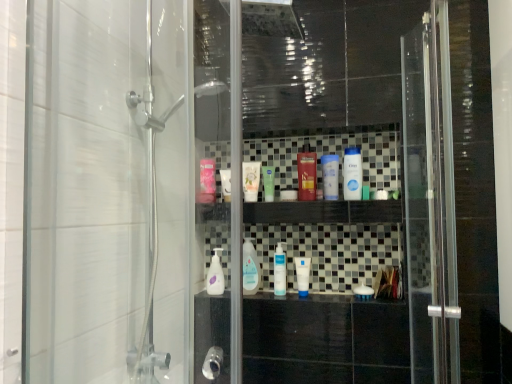
Measure the distance between point (256, 268) and camera.

Point (256, 268) is 5.53 feet from camera.

Where is `white glossy mouthwash at center, which appears as the fourth mouthwash when viewed from the right`? This screenshot has width=512, height=384. white glossy mouthwash at center, which appears as the fourth mouthwash when viewed from the right is located at coordinates (279, 271).

What do you see at coordinates (303, 275) in the screenshot? This screenshot has height=384, width=512. I see `white matte tube at center, the second toiletry positioned from the left` at bounding box center [303, 275].

Locate an element on the screen. Image resolution: width=512 pixels, height=384 pixels. transparent glass screen door at center is located at coordinates (324, 219).

Describe the element at coordinates (306, 176) in the screenshot. The width and height of the screenshot is (512, 384). I see `shiny red plastic bottle at center, arranged as the fifth mouthwash when viewed from the left` at that location.

This screenshot has width=512, height=384. Find the location of `white glossy mouthwash at upper center, the 1th mouthwash viewed from the right`. white glossy mouthwash at upper center, the 1th mouthwash viewed from the right is located at coordinates (352, 174).

Describe the element at coordinates (251, 180) in the screenshot. I see `white matte tube at center, which appears as the 1th toiletry when viewed from the left` at that location.

You are a GUI agent. You are given a task and a screenshot of the screen. Output one action in this format:
    pyautogui.click(x=<x>, y=<y>)
    Task: Click on the green matte tube at center, the fifth mouthwash when ordered from right to left
    The width and height of the screenshot is (512, 384).
    Given the screenshot: What is the action you would take?
    pyautogui.click(x=268, y=182)

Find the location of `clear plastic mouthwash at center, the 2th mouthwash from the left`. clear plastic mouthwash at center, the 2th mouthwash from the left is located at coordinates (250, 268).

Does white matte tube at center, the second toiletry from the top, contain clear plastic mouthwash at center, acting as the 6th mouthwash starting from the right?

No, clear plastic mouthwash at center, acting as the 6th mouthwash starting from the right, is not inside white matte tube at center, the second toiletry from the top.

Is clear plastic mouthwash at center, acting as the 6th mouthwash starting from the right, at the back of white matte tube at center, the second toiletry from the top?

No.

Is white matte tube at center, the second toiletry positioned from the left, bigger than clear plastic mouthwash at center, the 2th mouthwash from the left?

Actually, white matte tube at center, the second toiletry positioned from the left, might be smaller than clear plastic mouthwash at center, the 2th mouthwash from the left.

Considering the relative sizes of white matte tube at center, the second toiletry from the top, and white glossy mouthwash at upper center, acting as the seventh mouthwash starting from the left, in the image provided, is white matte tube at center, the second toiletry from the top, smaller than white glossy mouthwash at upper center, acting as the seventh mouthwash starting from the left,?

Yes, white matte tube at center, the second toiletry from the top, is smaller than white glossy mouthwash at upper center, acting as the seventh mouthwash starting from the left.

Is white matte tube at center, acting as the first toiletry starting from the right, completely or partially outside of white glossy mouthwash at upper center, the 1th mouthwash viewed from the right?

white matte tube at center, acting as the first toiletry starting from the right, lies outside white glossy mouthwash at upper center, the 1th mouthwash viewed from the right,'s area.

Which of these two, white matte tube at center, the second toiletry positioned from the left, or white glossy mouthwash at upper center, the 1th mouthwash viewed from the right, is wider?

white glossy mouthwash at upper center, the 1th mouthwash viewed from the right.

Is clear plastic mouthwash at center, acting as the 6th mouthwash starting from the right, aimed at white glossy mouthwash at center, marked as the 4th mouthwash in a left-to-right arrangement?

No, clear plastic mouthwash at center, acting as the 6th mouthwash starting from the right, is not turned towards white glossy mouthwash at center, marked as the 4th mouthwash in a left-to-right arrangement.

From the image's perspective, does clear plastic mouthwash at center, acting as the 6th mouthwash starting from the right, appear lower than white glossy mouthwash at center, which appears as the fourth mouthwash when viewed from the right?

No, from the image's perspective, clear plastic mouthwash at center, acting as the 6th mouthwash starting from the right, is not beneath white glossy mouthwash at center, which appears as the fourth mouthwash when viewed from the right.

You are a GUI agent. You are given a task and a screenshot of the screen. Output one action in this format:
    pyautogui.click(x=<x>, y=<y>)
    Task: Click on the 1st mouthwash above when counting from the white glossy mouthwash at center, marked as the 4th mouthwash in a left-to-right arrangement (from the image's perspective)
    This screenshot has width=512, height=384.
    Given the screenshot: What is the action you would take?
    pyautogui.click(x=250, y=268)

From a real-world perspective, is clear plastic mouthwash at center, acting as the 6th mouthwash starting from the right, on white glossy mouthwash at center, marked as the 4th mouthwash in a left-to-right arrangement?

Indeed, from a real-world perspective, clear plastic mouthwash at center, acting as the 6th mouthwash starting from the right, stands above white glossy mouthwash at center, marked as the 4th mouthwash in a left-to-right arrangement.

Is white matte tube at center, the second toiletry from the top, not near green matte tube at center, placed as the third mouthwash when sorted from left to right?

No, white matte tube at center, the second toiletry from the top, is not far from green matte tube at center, placed as the third mouthwash when sorted from left to right.

Considering the sizes of white matte tube at center, the 1th toiletry ordered from the bottom, and green matte tube at center, the fifth mouthwash when ordered from right to left, in the image, is white matte tube at center, the 1th toiletry ordered from the bottom, wider or thinner than green matte tube at center, the fifth mouthwash when ordered from right to left,?

Clearly, white matte tube at center, the 1th toiletry ordered from the bottom, has less width compared to green matte tube at center, the fifth mouthwash when ordered from right to left.

Where is `the 3rd mouthwash above the white matte tube at center, the second toiletry from the top (from a real-world perspective)`? the 3rd mouthwash above the white matte tube at center, the second toiletry from the top (from a real-world perspective) is located at coordinates (268, 182).

Is white matte tube at center, the second toiletry positioned from the left, positioned beyond the bounds of green matte tube at center, the fifth mouthwash when ordered from right to left?

Absolutely, white matte tube at center, the second toiletry positioned from the left, is external to green matte tube at center, the fifth mouthwash when ordered from right to left.

In the image, is shiny red plastic bottle at center, the third mouthwash viewed from the right, positioned in front of or behind clear plastic mouthwash at center, the 2th mouthwash from the left?

Visually, shiny red plastic bottle at center, the third mouthwash viewed from the right, is located in front of clear plastic mouthwash at center, the 2th mouthwash from the left.

Could clear plastic mouthwash at center, the 2th mouthwash from the left, be considered to be inside shiny red plastic bottle at center, arranged as the fifth mouthwash when viewed from the left?

No, shiny red plastic bottle at center, arranged as the fifth mouthwash when viewed from the left, does not contain clear plastic mouthwash at center, the 2th mouthwash from the left.

Is clear plastic mouthwash at center, acting as the 6th mouthwash starting from the right, at the back of shiny red plastic bottle at center, the third mouthwash viewed from the right?

No.

From a real-world perspective, does shiny red plastic bottle at center, arranged as the fifth mouthwash when viewed from the left, sit lower than clear plastic mouthwash at center, acting as the 6th mouthwash starting from the right?

No.

Starting from the white glossy mouthwash at upper center, acting as the seventh mouthwash starting from the left, which mouthwash is the 5th one to the left? Please provide its 2D coordinates.

[(250, 268)]

Looking at the image, does clear plastic mouthwash at center, the 2th mouthwash from the left, seem bigger or smaller compared to white glossy mouthwash at upper center, the 1th mouthwash viewed from the right?

Clearly, clear plastic mouthwash at center, the 2th mouthwash from the left, is larger in size than white glossy mouthwash at upper center, the 1th mouthwash viewed from the right.

Is clear plastic mouthwash at center, the 2th mouthwash from the left, facing away from white glossy mouthwash at upper center, acting as the seventh mouthwash starting from the left?

clear plastic mouthwash at center, the 2th mouthwash from the left, is not turned away from white glossy mouthwash at upper center, acting as the seventh mouthwash starting from the left.

Considering the positions of objects clear plastic mouthwash at center, the 2th mouthwash from the left, and white glossy mouthwash at upper center, the 1th mouthwash viewed from the right, in the image provided, who is more to the left, clear plastic mouthwash at center, the 2th mouthwash from the left, or white glossy mouthwash at upper center, the 1th mouthwash viewed from the right,?

clear plastic mouthwash at center, the 2th mouthwash from the left, is more to the left.

Which object is closer to the camera taking this photo, white glossy mouthwash at upper center, the 1th mouthwash viewed from the right, or clear plastic mouthwash at center, acting as the 6th mouthwash starting from the right?

Positioned in front is white glossy mouthwash at upper center, the 1th mouthwash viewed from the right.

Is white glossy mouthwash at upper center, the 1th mouthwash viewed from the right, looking in the opposite direction of clear plastic mouthwash at center, the 2th mouthwash from the left?

No, white glossy mouthwash at upper center, the 1th mouthwash viewed from the right, is not facing the opposite direction of clear plastic mouthwash at center, the 2th mouthwash from the left.

How many degrees apart are the facing directions of white glossy mouthwash at upper center, the 1th mouthwash viewed from the right, and clear plastic mouthwash at center, the 2th mouthwash from the left?

The angular difference between white glossy mouthwash at upper center, the 1th mouthwash viewed from the right, and clear plastic mouthwash at center, the 2th mouthwash from the left, is 0.00187 degrees.

Between white glossy mouthwash at upper center, the 1th mouthwash viewed from the right, and clear plastic mouthwash at center, the 2th mouthwash from the left, which one has larger size?

clear plastic mouthwash at center, the 2th mouthwash from the left, is bigger.

Which toiletry is the 2nd one when counting from the right side of the clear plastic mouthwash at center, the 2th mouthwash from the left? Please provide its 2D coordinates.

[(303, 275)]

This screenshot has height=384, width=512. There is a white matte tube at center, the second toiletry from the top. What are the coordinates of `the 6th mouthwash above it (from the image's perspective)` in the screenshot? It's located at (352, 174).

Estimate the real-world distances between objects in this image. Which object is further from green matte tube at center, placed as the third mouthwash when sorted from left to right, white matte tube at center, which appears as the 1th toiletry when viewed from the left, or blue plastic mouthwash at center, the 2th mouthwash when ordered from right to left?

Answer: blue plastic mouthwash at center, the 2th mouthwash when ordered from right to left.

Considering their positions, is transparent glass screen door at center positioned closer to shiny red plastic bottle at center, arranged as the fifth mouthwash when viewed from the left, than white glossy mouthwash at upper center, acting as the seventh mouthwash starting from the left?

Among the two, white glossy mouthwash at upper center, acting as the seventh mouthwash starting from the left, is located nearer to shiny red plastic bottle at center, arranged as the fifth mouthwash when viewed from the left.

Which object lies further to the anchor point shiny red plastic bottle at center, arranged as the fifth mouthwash when viewed from the left, clear plastic mouthwash at center, acting as the 6th mouthwash starting from the right, or blue plastic mouthwash at center, the sixth mouthwash viewed from the left?

Based on the image, clear plastic mouthwash at center, acting as the 6th mouthwash starting from the right, appears to be further to shiny red plastic bottle at center, arranged as the fifth mouthwash when viewed from the left.

When comparing their distances from blue plastic mouthwash at center, the 2th mouthwash when ordered from right to left, does clear plastic mouthwash at center, the 2th mouthwash from the left, or green matte tube at center, the fifth mouthwash when ordered from right to left, seem further?

clear plastic mouthwash at center, the 2th mouthwash from the left, is further to blue plastic mouthwash at center, the 2th mouthwash when ordered from right to left.

Looking at the image, which one is located closer to shiny red plastic bottle at center, arranged as the fifth mouthwash when viewed from the left, white matte tube at center, acting as the second toiletry starting from the right, or blue plastic mouthwash at center, the sixth mouthwash viewed from the left?

blue plastic mouthwash at center, the sixth mouthwash viewed from the left, lies closer to shiny red plastic bottle at center, arranged as the fifth mouthwash when viewed from the left, than the other object.

When comparing their distances from shiny red plastic bottle at center, the third mouthwash viewed from the right, does white matte tube at center, which appears as the 1th toiletry when viewed from the left, or pink glossy mouthwash at center, marked as the first mouthwash in a left-to-right arrangement, seem further?

Based on the image, pink glossy mouthwash at center, marked as the first mouthwash in a left-to-right arrangement, appears to be further to shiny red plastic bottle at center, the third mouthwash viewed from the right.

From the image, which object appears to be farther from pink glossy mouthwash at center, marked as the first mouthwash in a left-to-right arrangement, shiny red plastic bottle at center, the third mouthwash viewed from the right, or transparent glass screen door at center?

transparent glass screen door at center lies further to pink glossy mouthwash at center, marked as the first mouthwash in a left-to-right arrangement, than the other object.

Estimate the real-world distances between objects in this image. Which object is further from white matte tube at center, the second toiletry from the top, shiny red plastic bottle at center, the third mouthwash viewed from the right, or clear plastic mouthwash at center, acting as the 6th mouthwash starting from the right?

shiny red plastic bottle at center, the third mouthwash viewed from the right, is positioned further to the anchor white matte tube at center, the second toiletry from the top.

Image resolution: width=512 pixels, height=384 pixels. I want to click on toiletry between transparent glass screen door at center and clear plastic mouthwash at center, the 2th mouthwash from the left, from front to back, so click(x=303, y=275).

Where is `toiletry between pink glossy mouthwash at center, acting as the seventh mouthwash starting from the right, and white matte tube at center, the second toiletry positioned from the left, vertically`? toiletry between pink glossy mouthwash at center, acting as the seventh mouthwash starting from the right, and white matte tube at center, the second toiletry positioned from the left, vertically is located at coordinates (251, 180).

At what (x,y) coordinates should I click in order to perform the action: click on toiletry between blue plastic mouthwash at center, the 2th mouthwash when ordered from right to left, and clear plastic mouthwash at center, acting as the 6th mouthwash starting from the right, from top to bottom. Please return your answer as a coordinate pair (x, y). The height and width of the screenshot is (384, 512). Looking at the image, I should click on (251, 180).

The height and width of the screenshot is (384, 512). I want to click on toiletry between pink glossy mouthwash at center, marked as the first mouthwash in a left-to-right arrangement, and clear plastic mouthwash at center, the 2th mouthwash from the left, vertically, so click(251, 180).